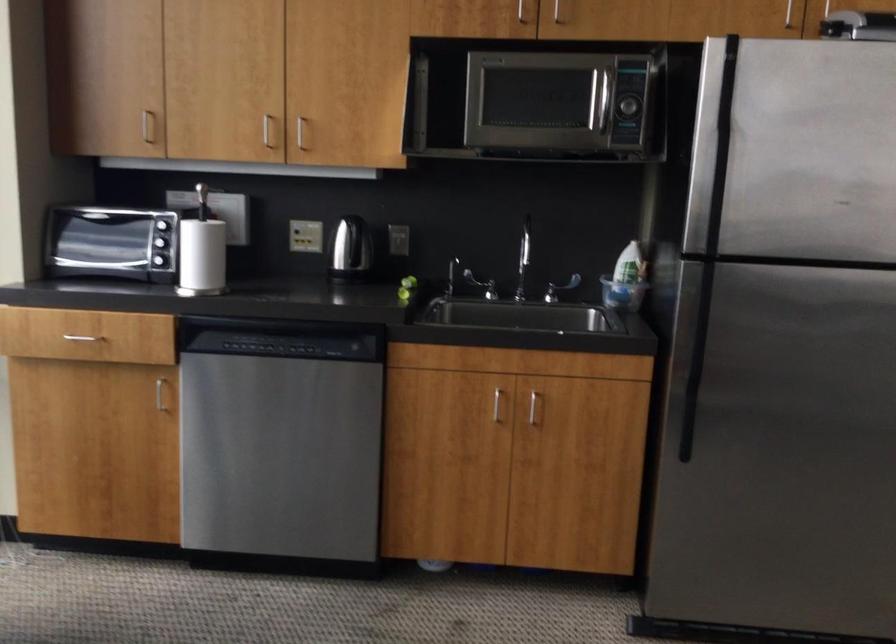
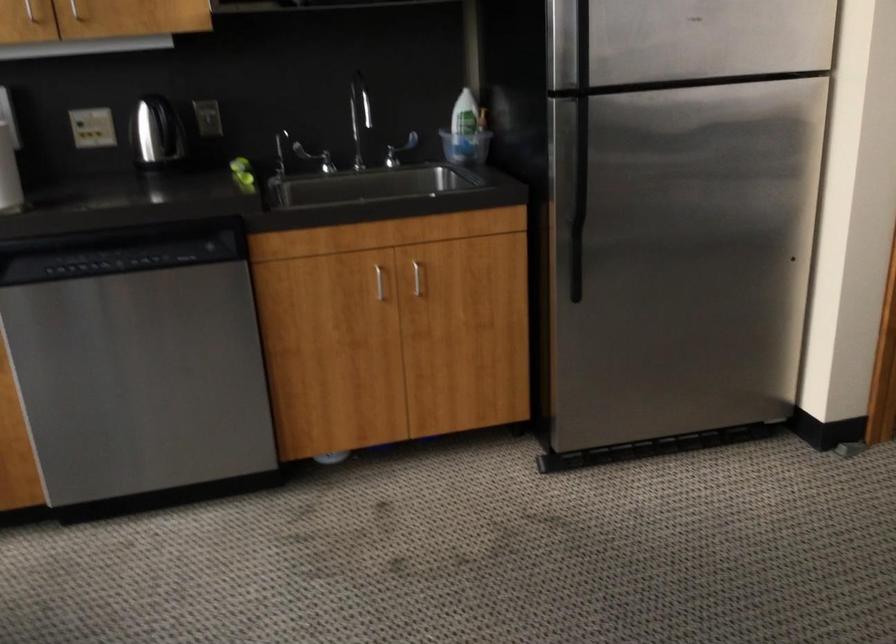
In the scene shown: The images are taken continuously from a first-person perspective. In which direction are you moving?

The cameraman moved toward left, forward.